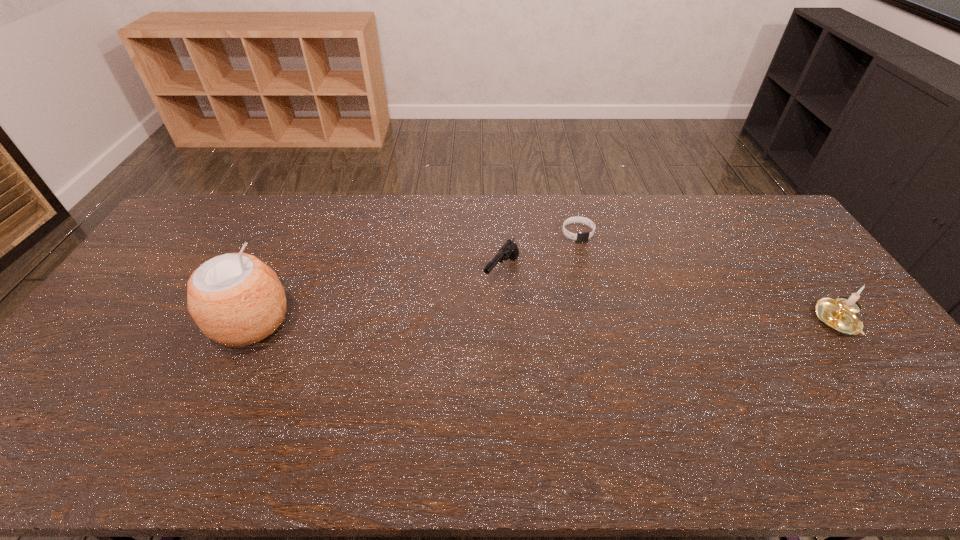
Image resolution: width=960 pixels, height=540 pixels. I want to click on the leftmost object, so coord(235,299).

This screenshot has height=540, width=960. I want to click on coconut, so click(235, 299).

Locate an element on the screen. The image size is (960, 540). the rightmost object is located at coordinates (839, 315).

Find the location of a particular element. The height and width of the screenshot is (540, 960). the third shortest object is located at coordinates (839, 315).

Locate an element on the screen. Image resolution: width=960 pixels, height=540 pixels. the third object from left to right is located at coordinates (580, 236).

Locate an element on the screen. This screenshot has width=960, height=540. wristband is located at coordinates (580, 236).

Locate an element on the screen. The image size is (960, 540). gun is located at coordinates (509, 250).

Where is `the third tallest object`? The height and width of the screenshot is (540, 960). the third tallest object is located at coordinates (509, 250).

Where is `vacant space situated 0.180m on the right of the leftmost object`? The width and height of the screenshot is (960, 540). vacant space situated 0.180m on the right of the leftmost object is located at coordinates (354, 322).

This screenshot has height=540, width=960. Identify the location of free location located 0.070m on the handle side of the second tallest object. (871, 366).